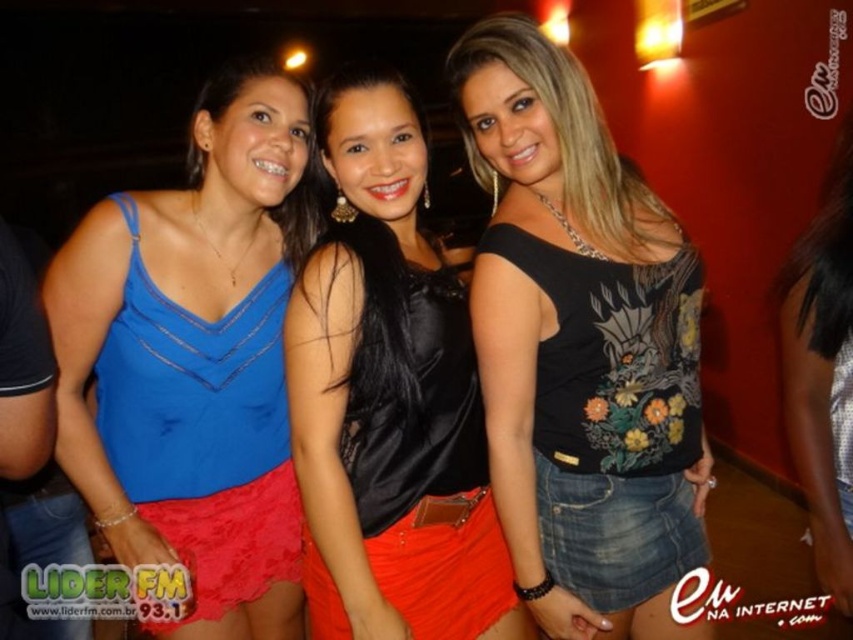
You are planning to buy a new outfit and want to match the width of your existing tops. You have the blue satin tank top at left and the black satin top at center. Which one should you choose if you want a wider top?

The blue satin tank top at left is wider than the black satin top at center, so you should choose the blue satin tank top at left for a wider fit.

You are at a party and want to take a photo of the denim skirt at lower right without the blue satin tank top at left blocking it. How should you position yourself to achieve this?

Move to the side opposite of the blue satin tank top at left so that the denim skirt at lower right is no longer blocked by it.

You are at a party and want to take a photo of the blue satin tank top at left. Where should you look to find it?

The blue satin tank top at left is located at point (194, 358).